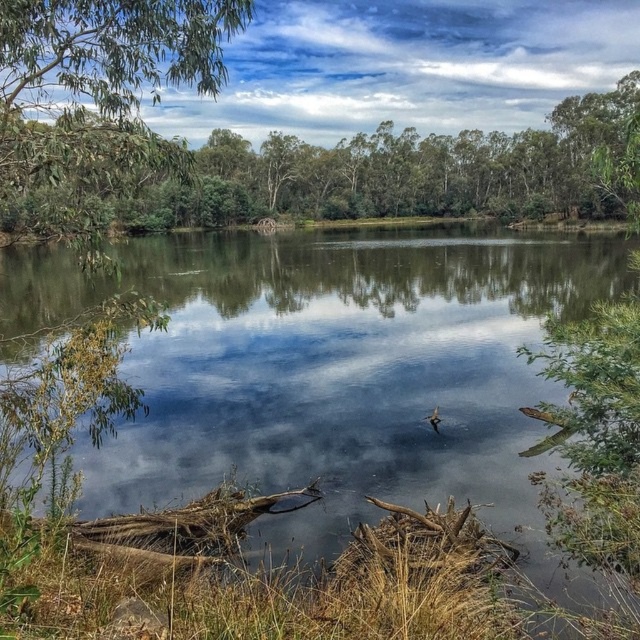
Question: Is clear water at center below green leafy tree at upper left?

Choices:
 (A) yes
 (B) no

Answer: (B)

Question: Among these points, which one is nearest to the camera?

Choices:
 (A) (81, 88)
 (B) (432, 480)

Answer: (A)

Question: Does clear water at center have a lesser width compared to green leafy tree at upper left?

Choices:
 (A) yes
 (B) no

Answer: (B)

Question: Is clear water at center above green leafy tree at upper left?

Choices:
 (A) no
 (B) yes

Answer: (B)

Question: Which point is farther to the camera?

Choices:
 (A) (333, 288)
 (B) (227, 3)

Answer: (A)